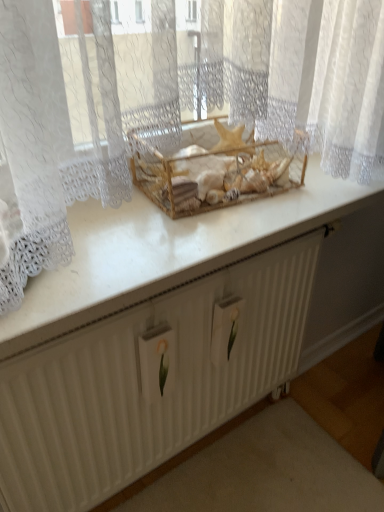
Question: Considering the positions of point (94, 250) and point (253, 161), is point (94, 250) closer or farther from the camera than point (253, 161)?

Choices:
 (A) farther
 (B) closer

Answer: (B)

Question: Considering their positions, is white glossy counter top at center located in front of or behind wooden crate at center?

Choices:
 (A) behind
 (B) front

Answer: (B)

Question: Based on their relative distances, which object is farther from the white textured radiator at center?

Choices:
 (A) white glossy counter top at center
 (B) wooden crate at center

Answer: (B)

Question: Which of these objects is positioned farthest from the white glossy counter top at center?

Choices:
 (A) white textured radiator at center
 (B) wooden crate at center

Answer: (A)